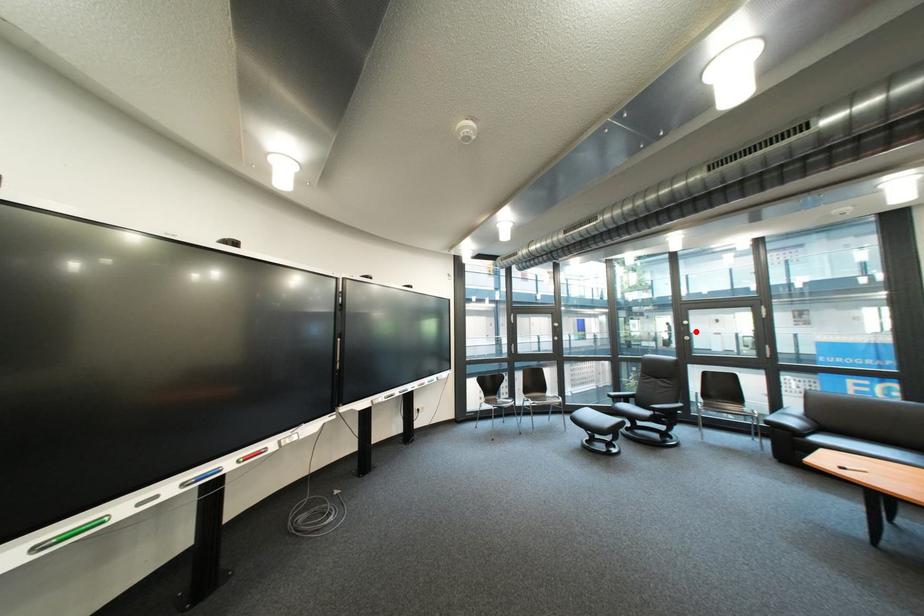
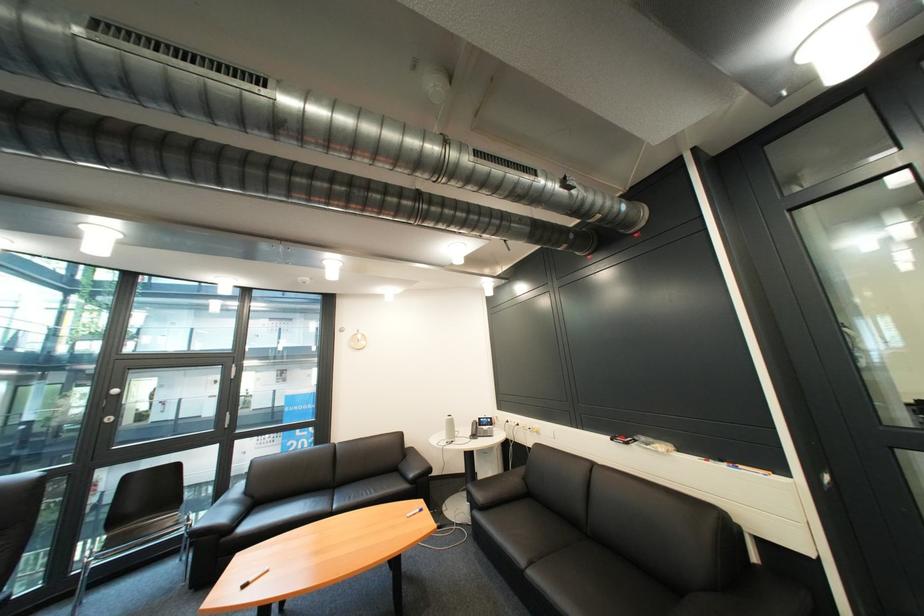
Find the pixel in the second image that matches the highlighted location in the first image.

(118, 408)